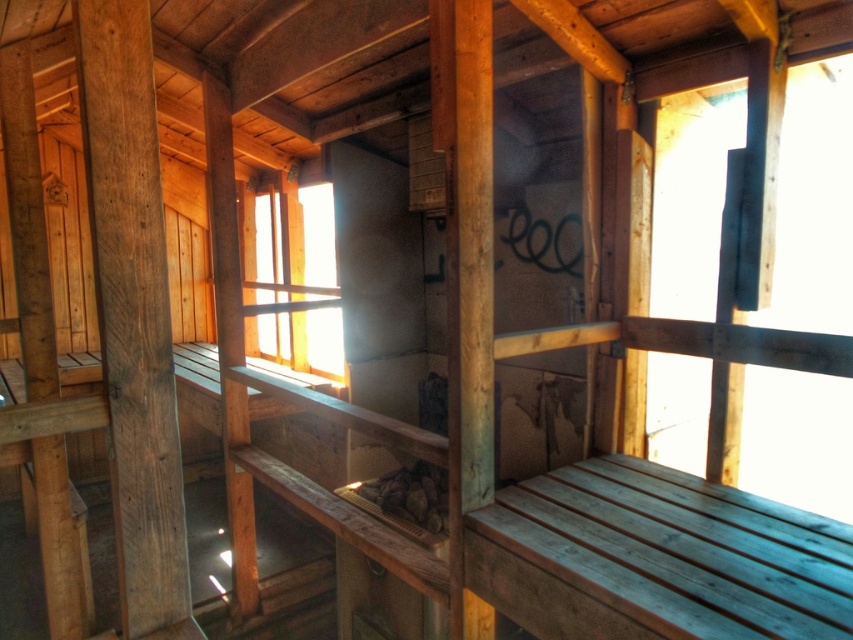
Can you confirm if transparent glass window at upper right is wider than smooth brown wood beam at left?

Indeed, transparent glass window at upper right has a greater width compared to smooth brown wood beam at left.

Is point (703, 372) positioned in front of point (134, 579)?

That is False.

Describe the element at coordinates (813, 202) in the screenshot. The width and height of the screenshot is (853, 640). I see `transparent glass window at upper right` at that location.

Locate an element on the screen. transparent glass window at upper right is located at coordinates (813, 202).

Does transparent glass window at upper right have a smaller size compared to transparent glass window at center?

Actually, transparent glass window at upper right might be larger than transparent glass window at center.

Is transparent glass window at upper right wider than transparent glass window at center?

Indeed, transparent glass window at upper right has a greater width compared to transparent glass window at center.

Does point (663, 390) come closer to viewer compared to point (254, 244)?

Yes, it is.

The height and width of the screenshot is (640, 853). Identify the location of transparent glass window at upper right. (813, 202).

Who is positioned more to the right, smooth brown wood beam at left or transparent glass window at center?

Positioned to the right is smooth brown wood beam at left.

Is smooth brown wood beam at left to the left of transparent glass window at center from the viewer's perspective?

Incorrect, smooth brown wood beam at left is not on the left side of transparent glass window at center.

In order to click on smooth brown wood beam at left in this screenshot , I will do `click(132, 314)`.